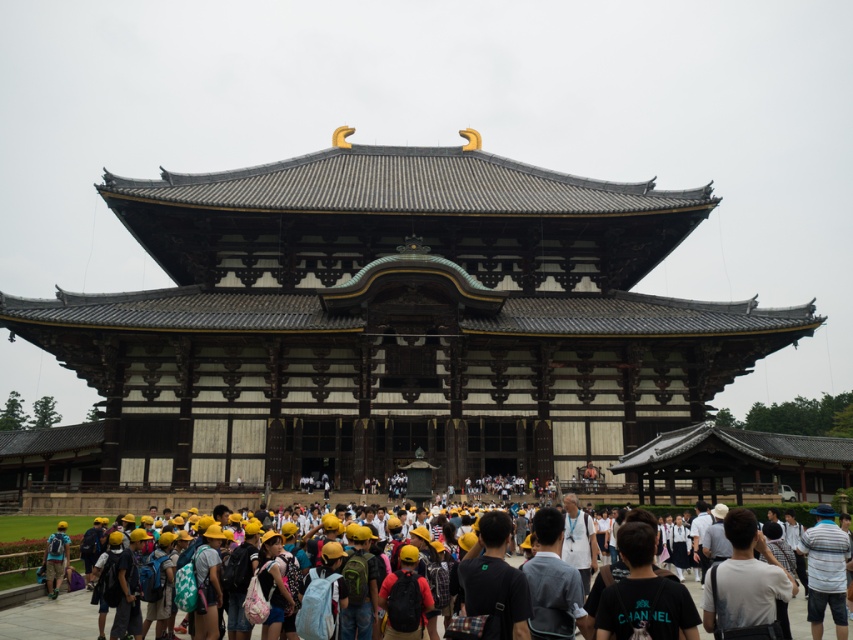
Between dark brown wooden temple at center and white cotton shirt at center, which one is positioned lower?

white cotton shirt at center

Image resolution: width=853 pixels, height=640 pixels. I want to click on dark brown wooden temple at center, so click(392, 323).